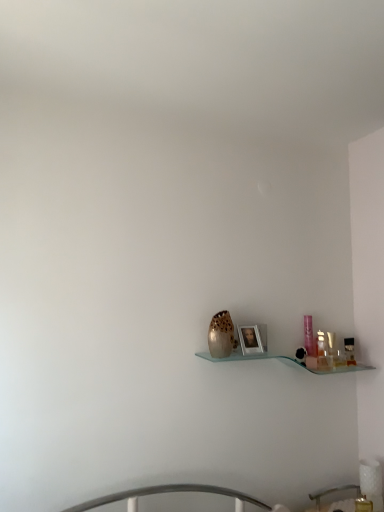
Question: Considering the relative sizes of black plastic toiletry at right, the 2th toiletry when ordered from left to right, and translucent plastic bottle at right, the first toiletry from the left, in the image provided, is black plastic toiletry at right, the 2th toiletry when ordered from left to right, taller than translucent plastic bottle at right, the first toiletry from the left,?

Choices:
 (A) no
 (B) yes

Answer: (A)

Question: Does black plastic toiletry at right, the first toiletry positioned from the right, appear on the left side of translucent plastic bottle at right, the 2th toiletry positioned from the right?

Choices:
 (A) no
 (B) yes

Answer: (A)

Question: Does black plastic toiletry at right, the first toiletry positioned from the right, lie behind translucent plastic bottle at right, the 2th toiletry positioned from the right?

Choices:
 (A) yes
 (B) no

Answer: (A)

Question: Does black plastic toiletry at right, the first toiletry positioned from the right, have a greater width compared to translucent plastic bottle at right, the first toiletry from the left?

Choices:
 (A) no
 (B) yes

Answer: (A)

Question: Would you say translucent plastic bottle at right, the 2th toiletry positioned from the right, is part of black plastic toiletry at right, the first toiletry positioned from the right,'s contents?

Choices:
 (A) no
 (B) yes

Answer: (A)

Question: From the image's perspective, is black plastic toiletry at right, the first toiletry positioned from the right, beneath translucent glass vase at center?

Choices:
 (A) no
 (B) yes

Answer: (B)

Question: Does black plastic toiletry at right, the first toiletry positioned from the right, turn towards translucent glass vase at center?

Choices:
 (A) yes
 (B) no

Answer: (B)

Question: Can you confirm if black plastic toiletry at right, the 2th toiletry when ordered from left to right, is bigger than translucent glass vase at center?

Choices:
 (A) no
 (B) yes

Answer: (A)

Question: Is black plastic toiletry at right, the 2th toiletry when ordered from left to right, behind translucent glass vase at center?

Choices:
 (A) no
 (B) yes

Answer: (B)

Question: Considering the relative positions of black plastic toiletry at right, the first toiletry positioned from the right, and translucent glass vase at center in the image provided, is black plastic toiletry at right, the first toiletry positioned from the right, to the left of translucent glass vase at center from the viewer's perspective?

Choices:
 (A) yes
 (B) no

Answer: (B)

Question: From the image's perspective, does translucent glass vase at center appear lower than translucent plastic bottle at right, the first toiletry from the left?

Choices:
 (A) yes
 (B) no

Answer: (B)